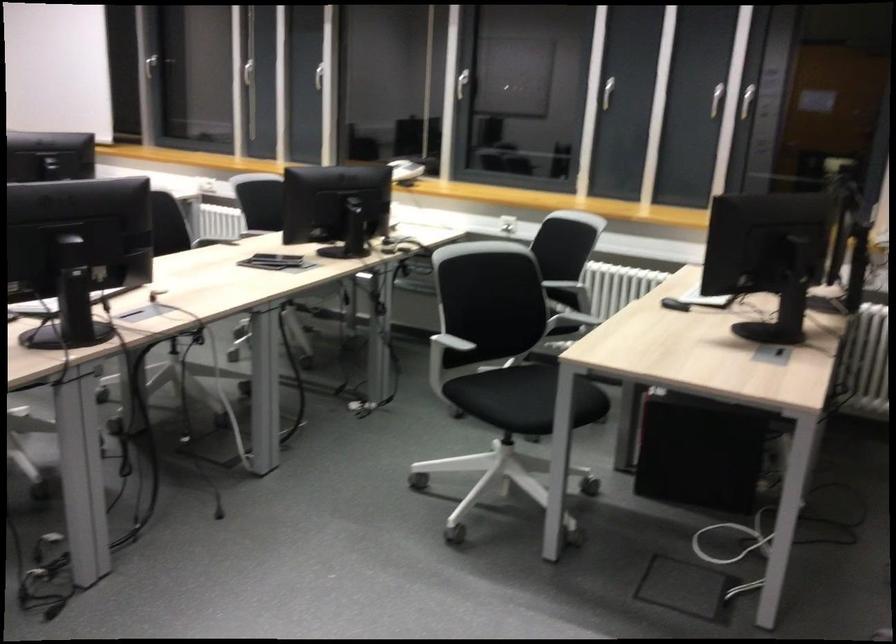
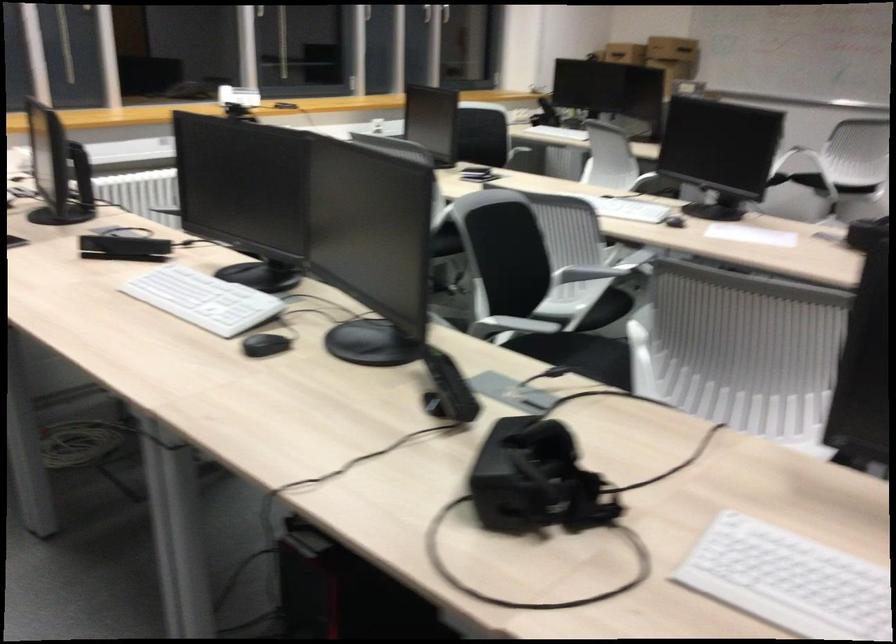
Question: I am providing you with two images of the same scene from different viewpoints. Which of the following objects are not visible in image2?

Choices:
 (A) small measuring cup
 (B) black chair sitting surface
 (C) telephone handset
 (D) black computer mouse

Answer: (B)